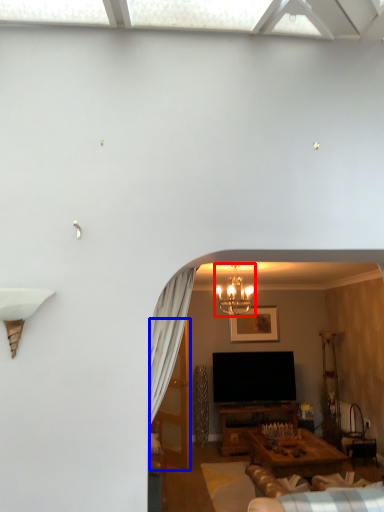
Question: Which object is further to the camera taking this photo, light fixture (highlighted by a red box) or glass door (highlighted by a blue box)?

Choices:
 (A) light fixture
 (B) glass door

Answer: (B)